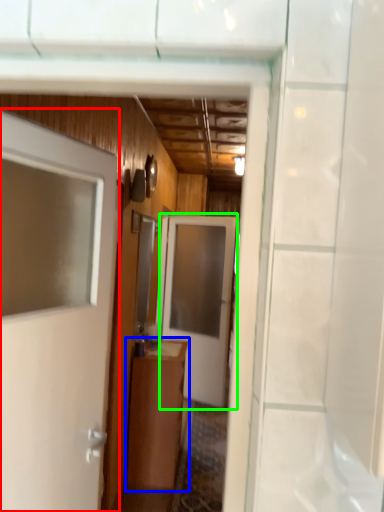
Question: Which object is the farthest from door (highlighted by a red box)? Choose among these: cabinetry (highlighted by a blue box) or door (highlighted by a green box).

Choices:
 (A) cabinetry
 (B) door

Answer: (B)